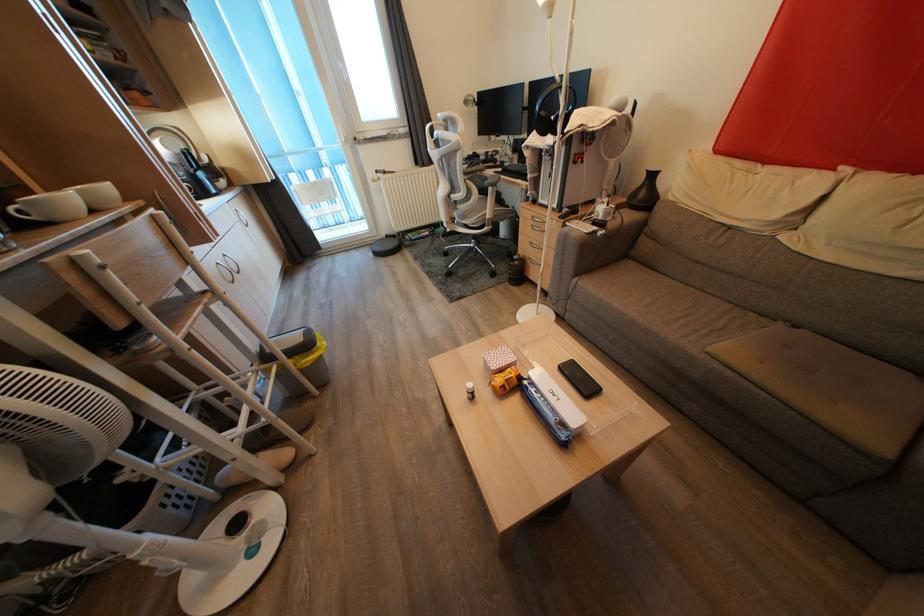
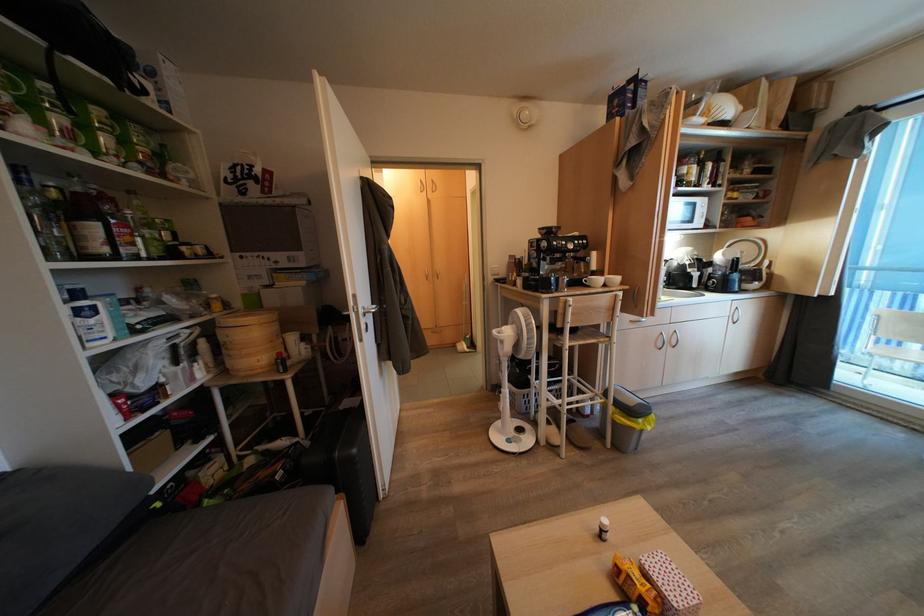
Locate, in the second image, the point that corresponds to point (126, 329) in the first image.

(564, 330)